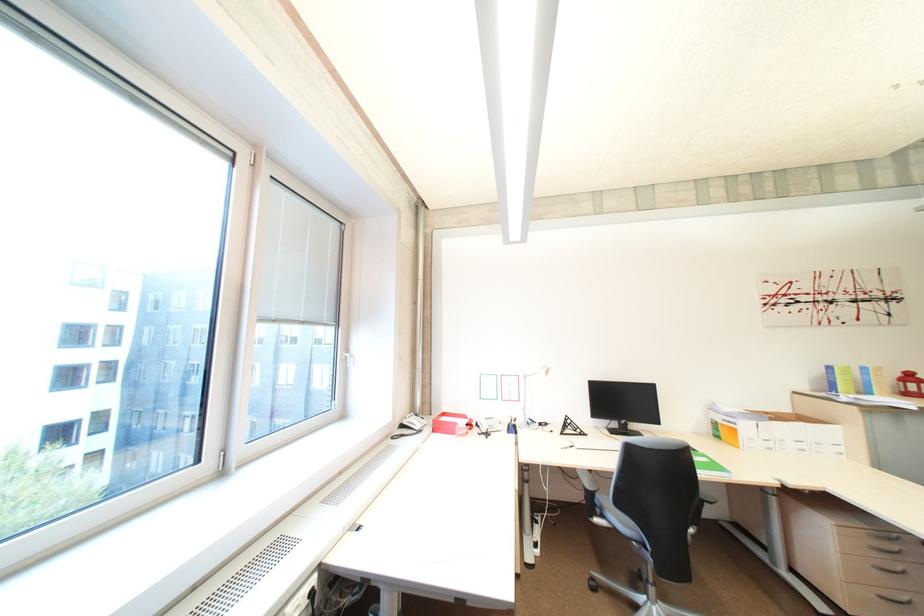
Where would you lift the red lantern object? Please return your answer as a coordinate pair (x, y).

(909, 384)